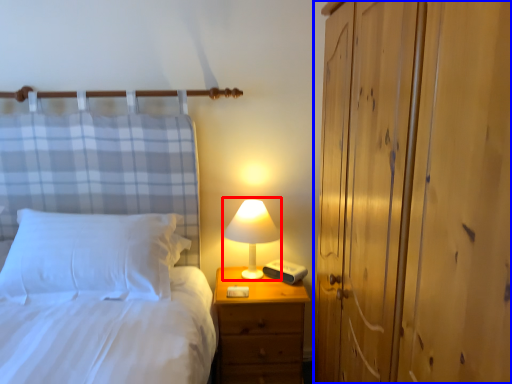
Question: Among these objects, which one is nearest to the camera, table lamp (highlighted by a red box) or dresser (highlighted by a blue box)?

Choices:
 (A) table lamp
 (B) dresser

Answer: (B)